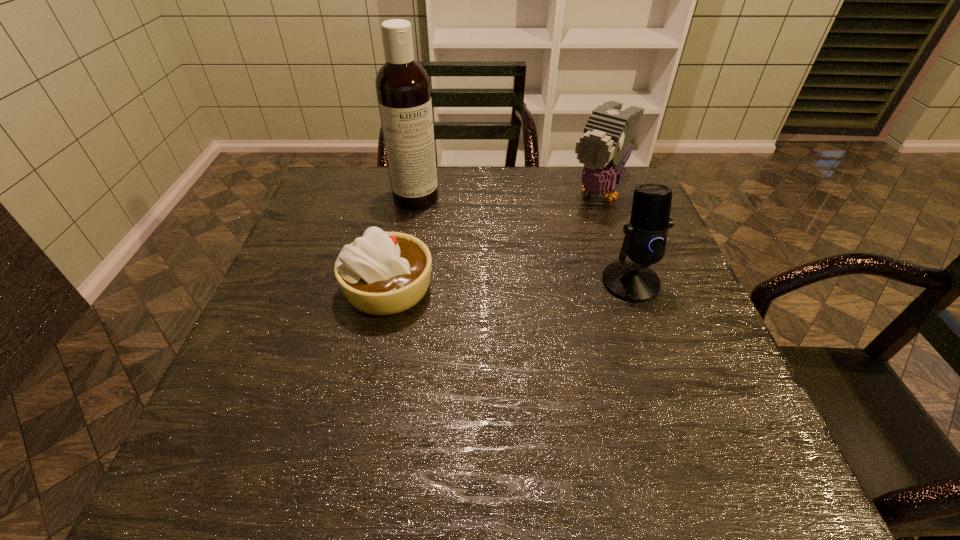
I want to click on the shortest object, so [382, 273].

Find the location of a particular element. This screenshot has width=960, height=540. microphone is located at coordinates (645, 239).

The width and height of the screenshot is (960, 540). What are the coordinates of `bird` in the screenshot? It's located at (604, 148).

Locate an element on the screen. This screenshot has height=540, width=960. dishwasher detergent is located at coordinates 402,85.

The width and height of the screenshot is (960, 540). I want to click on free space located 0.110m on the back of the whipped cream, so (401, 231).

This screenshot has height=540, width=960. I want to click on vacant space located on the stand of the microphone, so click(646, 327).

At what (x,y) coordinates should I click in order to perform the action: click on free space located 0.380m at the beak of the bird. Please return your answer as a coordinate pair (x, y). Looking at the image, I should click on (513, 298).

The width and height of the screenshot is (960, 540). In order to click on free space located at the beak of the bird in this screenshot , I will do `click(568, 234)`.

Where is `vacant space located at the beak of the bird`? vacant space located at the beak of the bird is located at coordinates (570, 232).

Identify the location of vacant region located on the label side of the tallest object. The image size is (960, 540). (476, 274).